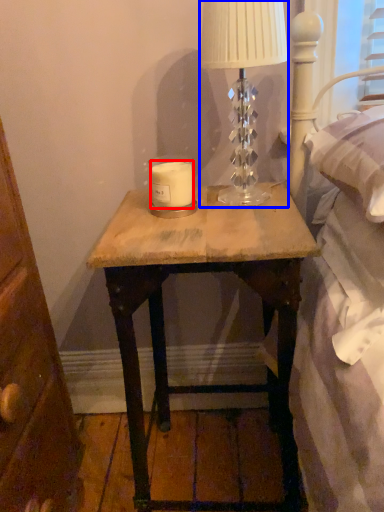
Question: Which of the following is the closest to the observer, candle (highlighted by a red box) or table lamp (highlighted by a blue box)?

Choices:
 (A) candle
 (B) table lamp

Answer: (B)